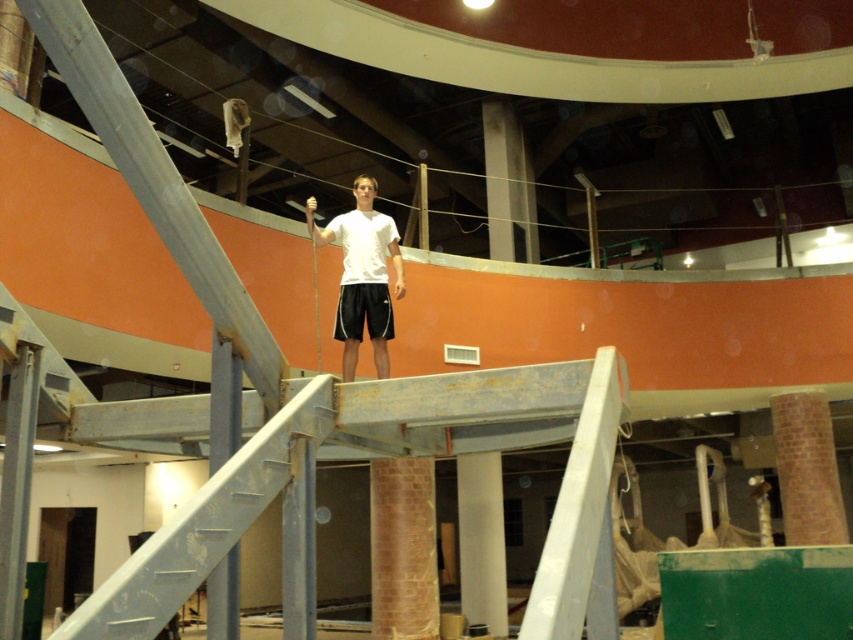
Question: Can you confirm if white matte shirt at center is positioned to the left of black cotton shorts at center?

Choices:
 (A) yes
 (B) no

Answer: (A)

Question: Which point is farther to the camera?

Choices:
 (A) (346, 241)
 (B) (418, 602)
 (C) (479, 486)
 (D) (357, 284)

Answer: (C)

Question: Estimate the real-world distances between objects in this image. Which object is closer to the black cotton shorts at center?

Choices:
 (A) brick textured pillar at center
 (B) white glossy column at center
 (C) white matte shirt at center

Answer: (C)

Question: Can you confirm if brick textured pillar at center is positioned below black cotton shorts at center?

Choices:
 (A) yes
 (B) no

Answer: (A)

Question: Which point is closer to the camera taking this photo?

Choices:
 (A) (482, 496)
 (B) (421, 563)
 (C) (392, 332)

Answer: (C)

Question: Does brick textured pillar at center appear over white matte shirt at center?

Choices:
 (A) no
 (B) yes

Answer: (A)